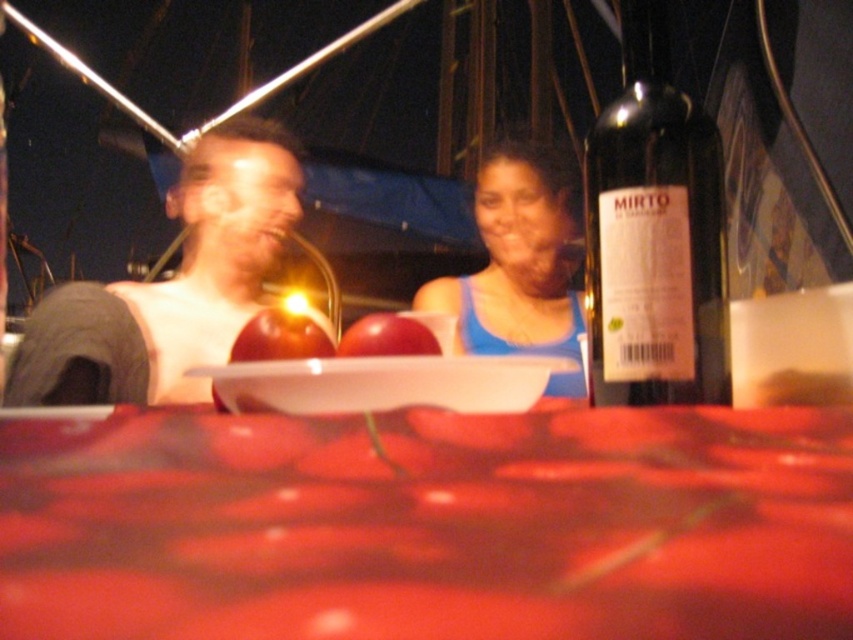
Question: Which object is positioned farthest from the matte white tank top at left?

Choices:
 (A) smooth red fabric at center
 (B) blue fabric tank top at center

Answer: (A)

Question: Does blue fabric tank top at center appear over glossy apple at center?

Choices:
 (A) no
 (B) yes

Answer: (B)

Question: Among these points, which one is nearest to the camera?

Choices:
 (A) (337, 364)
 (B) (576, 198)
 (C) (398, 328)

Answer: (A)

Question: Can you confirm if white glossy plate at center is positioned above shiny red apple at center?

Choices:
 (A) yes
 (B) no

Answer: (B)

Question: Does blue fabric tank top at center have a larger size compared to white glossy plate at center?

Choices:
 (A) yes
 (B) no

Answer: (A)

Question: Among these points, which one is nearest to the camera?

Choices:
 (A) (445, 419)
 (B) (543, 176)
 (C) (350, 404)

Answer: (A)